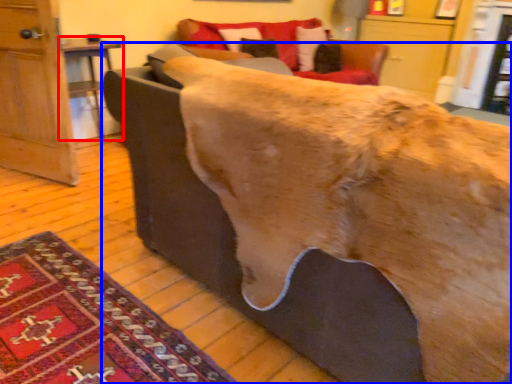
Question: Which object appears farthest to the camera in this image, table (highlighted by a red box) or furniture (highlighted by a blue box)?

Choices:
 (A) table
 (B) furniture

Answer: (A)